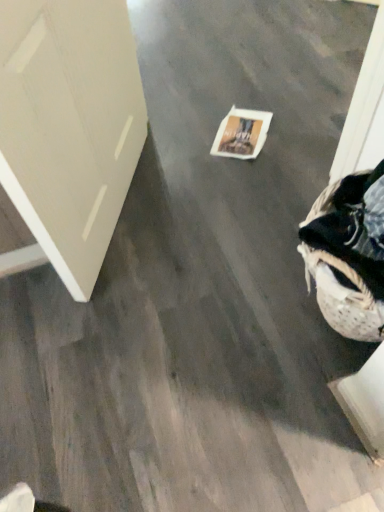
Locate an element on the screen. Image resolution: width=384 pixels, height=512 pixels. vacant space to the right of white matte door at left is located at coordinates (210, 198).